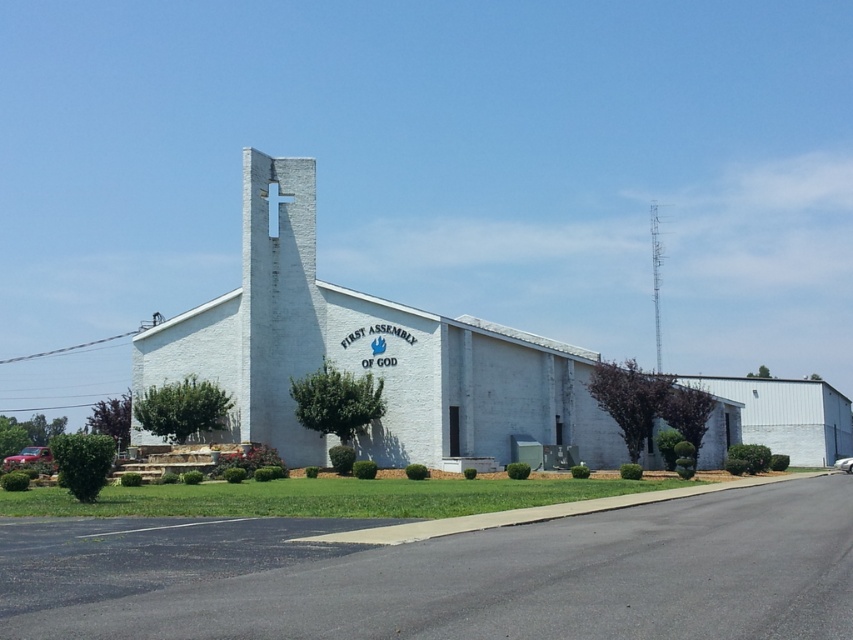
You are standing in front of the church and want to reach the point marked at coordinates point (440, 336). If your walking speed is 3 feet per second, how long will it take you to reach that point?

The point (440, 336) is 149.04 feet away from the viewer. At a walking speed of 3 feet per second, it would take approximately 49.68 seconds to reach the point.

You are standing in front of the church and want to take a photo. You notice two points marked in the scene. Which point, point (173, 358) or point (654, 204), is closer to you?

Point (173, 358) is closer to the camera than point (654, 204), so it is closer to you.